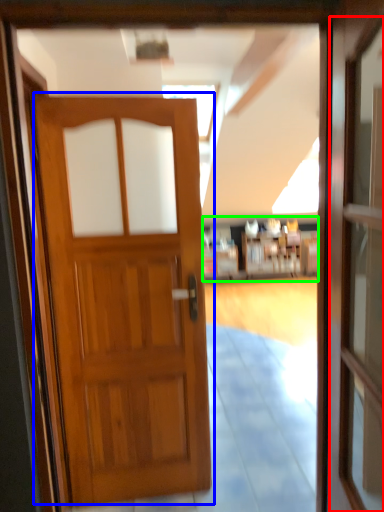
Question: Based on their relative distances, which object is farther from screen door (highlighted by a red box)? Choose from door (highlighted by a blue box) and hotel lobby (highlighted by a green box).

Choices:
 (A) door
 (B) hotel lobby

Answer: (B)